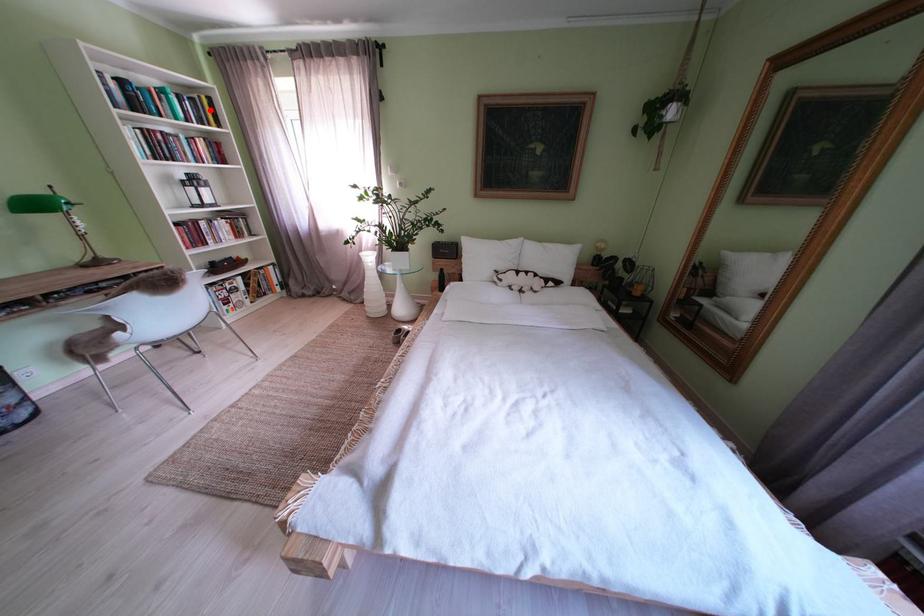
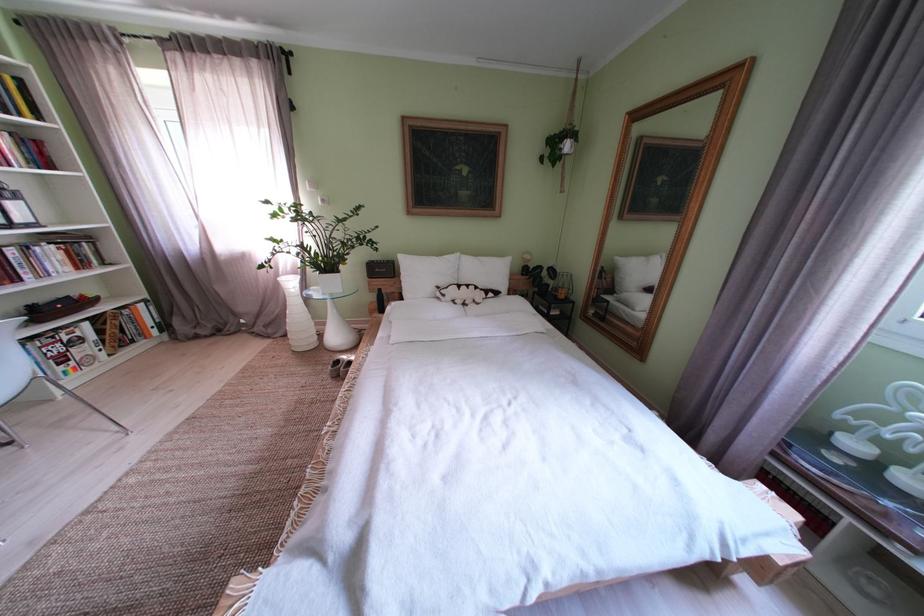
Where in the second image is the point corresponding to the highlighted location from the first image?

(9, 92)